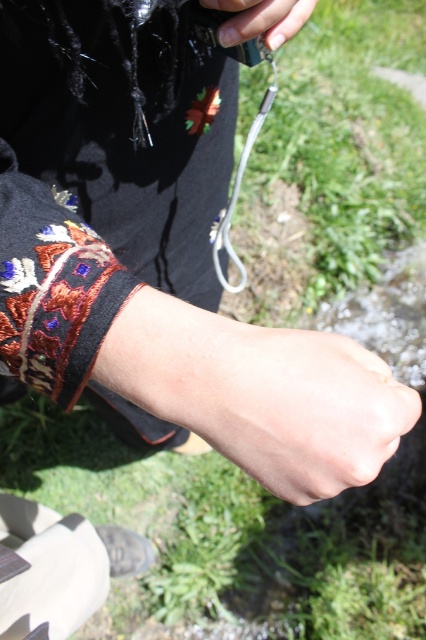
You are a dermatologist examining a closeup of a hand holding a camera near a stream. You notice dry skin at center and nail polish at center. Which object is nearer to your eyes?

The dry skin at center is closer to the viewer than nail polish at center, so the dry skin at center is nearer to your eyes.

You are a dermatologist examining a patient. You notice the dry skin at center and nail polish at center. Which object is located below the other?

The dry skin at center is positioned under the nail polish at center.

You are a dermatologist examining a closeup of a person holding a camera near a stream. You notice the dry skin at center. Based on its position, can you determine if it is on the palm or back of the hand?

The dry skin at center is located at coordinates point (x=299, y=406), which corresponds to the palm area of the hand.